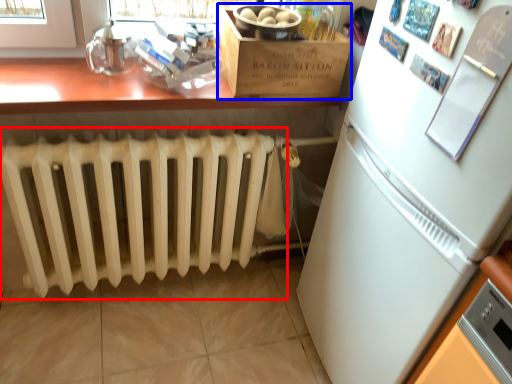
Question: Among these objects, which one is farthest to the camera, radiator (highlighted by a red box) or cardboard box (highlighted by a blue box)?

Choices:
 (A) radiator
 (B) cardboard box

Answer: (B)